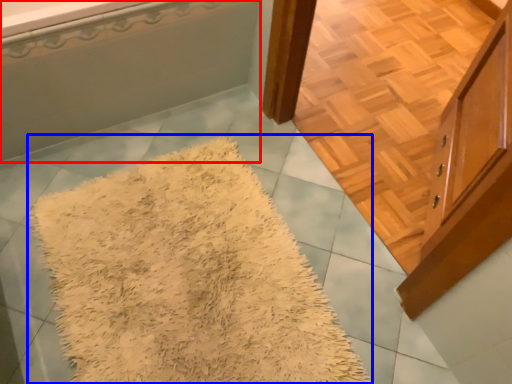
Question: Which object appears closest to the camera in this image, bathtub (highlighted by a red box) or mat (highlighted by a blue box)?

Choices:
 (A) bathtub
 (B) mat

Answer: (B)